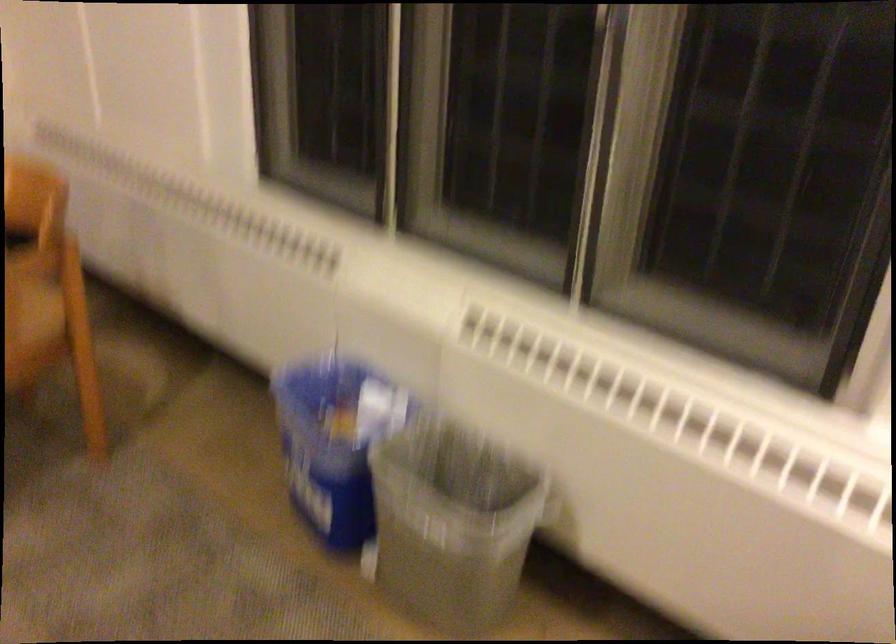
Locate an element on the screen. The image size is (896, 644). blue plastic bucket is located at coordinates (334, 442).